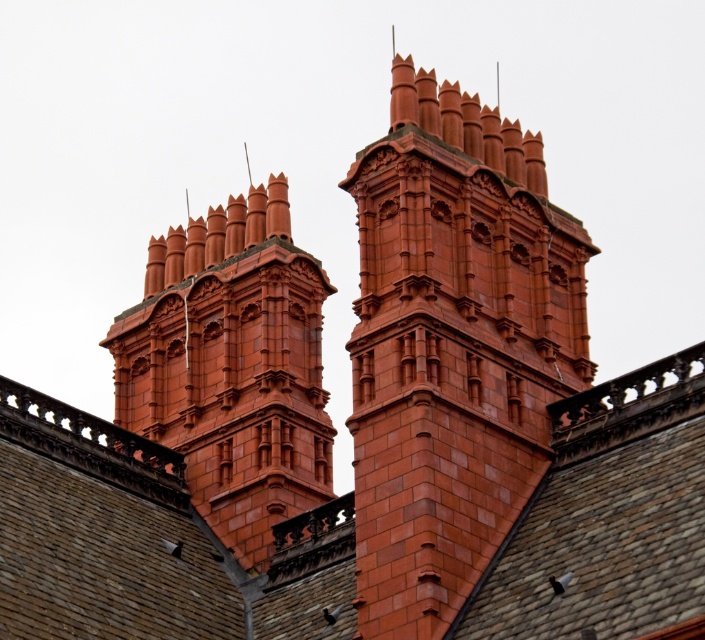
Between point (18, 634) and point (441, 138), which one is positioned behind?

The point (441, 138) is more distant.

Does smooth slate roof at center appear under matte brick tower at center?

Yes, smooth slate roof at center is below matte brick tower at center.

Identify the location of smooth slate roof at center. (145, 541).

What are the coordinates of `smooth slate roof at center` in the screenshot? It's located at coord(145,541).

Does matte brick tower at center appear over matte brick chimney at upper center?

Incorrect, matte brick tower at center is not positioned above matte brick chimney at upper center.

Between point (484, 285) and point (233, 273), which one is positioned behind?

Point (233, 273)

Does point (501, 275) come closer to viewer compared to point (314, 264)?

Yes, it is.

Identify the location of matte brick tower at center. The width and height of the screenshot is (705, 640). (453, 346).

Which is behind, point (352, 518) or point (288, 436)?

The point (288, 436) is behind.

Looking at this image, is smooth slate roof at center to the right of matte brick chimney at upper center from the viewer's perspective?

Correct, you'll find smooth slate roof at center to the right of matte brick chimney at upper center.

Between point (324, 531) and point (142, 346), which one is positioned in front?

Positioned in front is point (324, 531).

Image resolution: width=705 pixels, height=640 pixels. Identify the location of smooth slate roof at center. (145, 541).